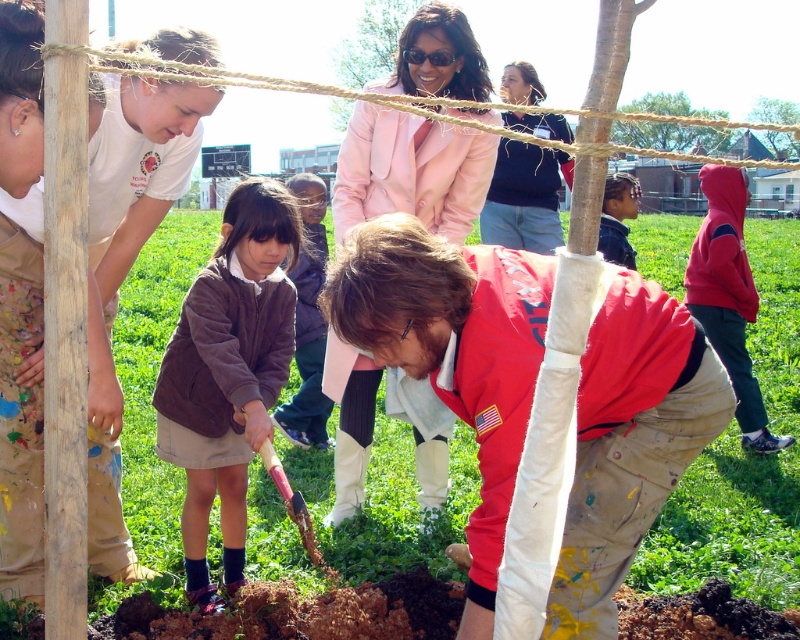
You are organizing a community event and need to arrange a banner between the brown fuzzy sweater at center and the smooth wooden post at upper right. Given that the banner requires 1.2 meters of space, will there be enough space between them?

The brown fuzzy sweater at center is narrower than the smooth wooden post at upper right, but the description does not provide specific measurements of the distance between them. Therefore, it is unclear if the 1.2 meters of space required for the banner is available.

You are a photographer at the tree planting event and want to take a picture of the brown fuzzy sweater at center and the smooth pink jacket at upper center. Which of the two is shorter?

The brown fuzzy sweater at center is shorter than the smooth pink jacket at upper center because it is not as tall as the smooth pink jacket at upper center.

You are a photographer aiming to capture a closeup of the red cotton shirt at center and the wooden shovel at center. Given that the camera can only focus on objects wider than 10 inches, will both items be in focus?

The red cotton shirt at center is wider than the wooden shovel at center. Since the camera focuses on objects wider than 10 inches, the red cotton shirt at center will be in focus, but the wooden shovel at center may not be if its width is under 10 inches.